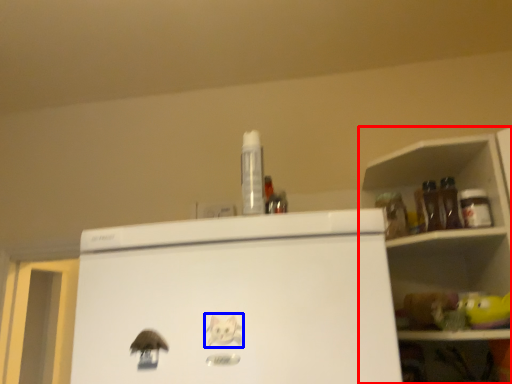
Question: Which object is closer to the camera taking this photo, shelf (highlighted by a red box) or animal (highlighted by a blue box)?

Choices:
 (A) shelf
 (B) animal

Answer: (B)